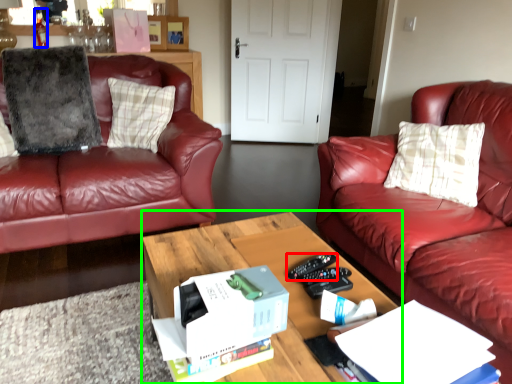
Question: Which object is the closest to the remote control (highlighted by a red box)? Choose among these: bottle (highlighted by a blue box) or coffee table (highlighted by a green box).

Choices:
 (A) bottle
 (B) coffee table

Answer: (B)